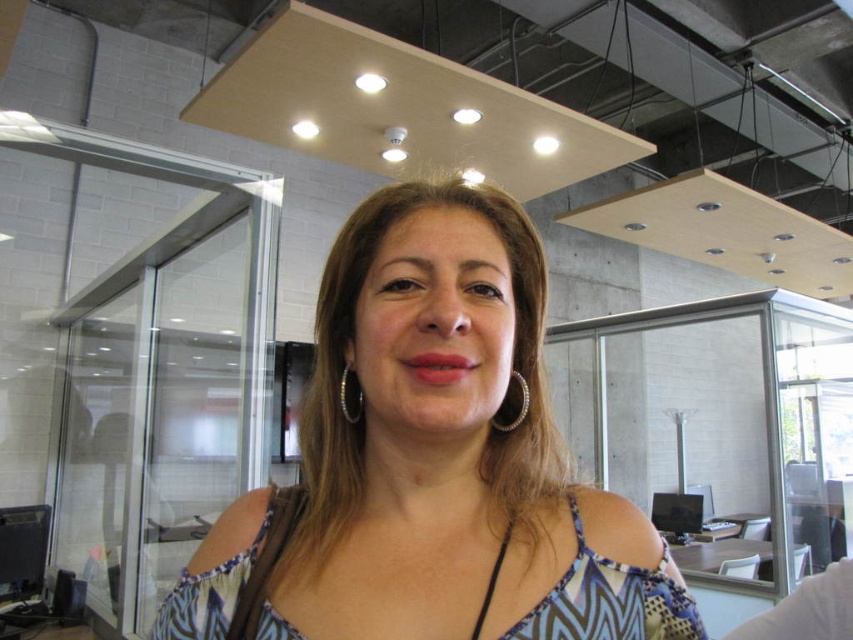
Question: Among these points, which one is nearest to the camera?

Choices:
 (A) (225, 600)
 (B) (341, 380)

Answer: (A)

Question: Does matte blue dress at center come behind silver metallic earring at center?

Choices:
 (A) no
 (B) yes

Answer: (A)

Question: Which of the following is the closest to the observer?

Choices:
 (A) (480, 209)
 (B) (521, 420)
 (C) (345, 384)

Answer: (A)

Question: Among these objects, which one is nearest to the camera?

Choices:
 (A) gold textured hoop at center
 (B) matte blue dress at center
 (C) silver metallic earring at center

Answer: (B)

Question: Can you confirm if matte blue dress at center is positioned below silver metallic earring at center?

Choices:
 (A) no
 (B) yes

Answer: (B)

Question: Does matte blue dress at center lie behind gold textured hoop at center?

Choices:
 (A) yes
 (B) no

Answer: (B)